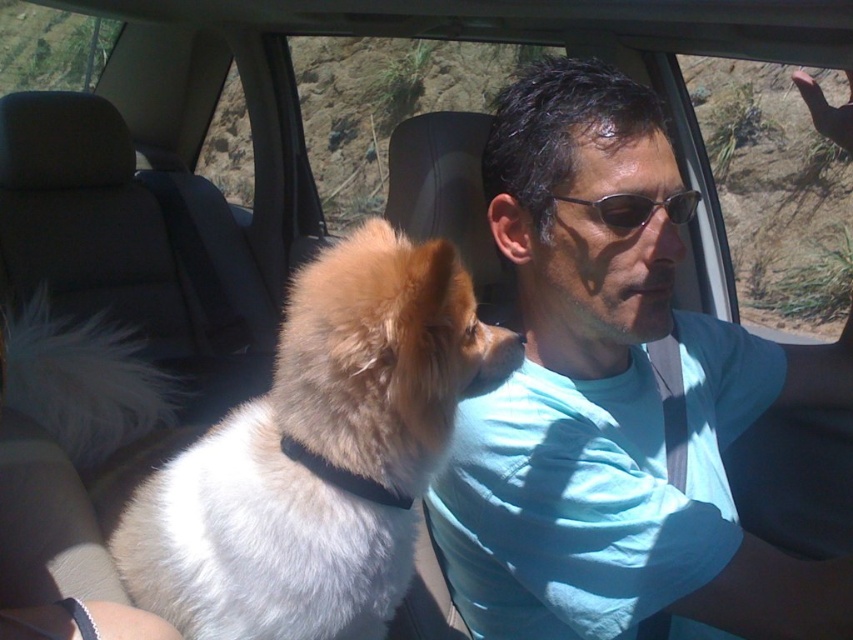
You are a delivery robot trying to deliver a package to the driver. You need to pass through the space between the white fluffy dog at center and the transparent glass car window at upper right. The package is 30 cm wide. Can you fit through the space?

The white fluffy dog at center is thinner than the transparent glass car window at upper right, so the space between them is wider than the dog. Since the package is 30 cm wide, it might fit if the space is sufficiently wide. However, without exact measurements, it is uncertain. The answer should be based on the given description.

You are a delivery robot that needs to deliver a package to the driver in the car. The robot has a camera that can detect objects within 30 inches. Can the robot detect the white fluffy dog at center to avoid it while delivering the package?

The white fluffy dog at center is 30.46 inches away from camera, which is slightly beyond the robot camera detection range of 30 inches. Therefore, the robot may not detect the white fluffy dog at center and should proceed with caution to avoid collision.